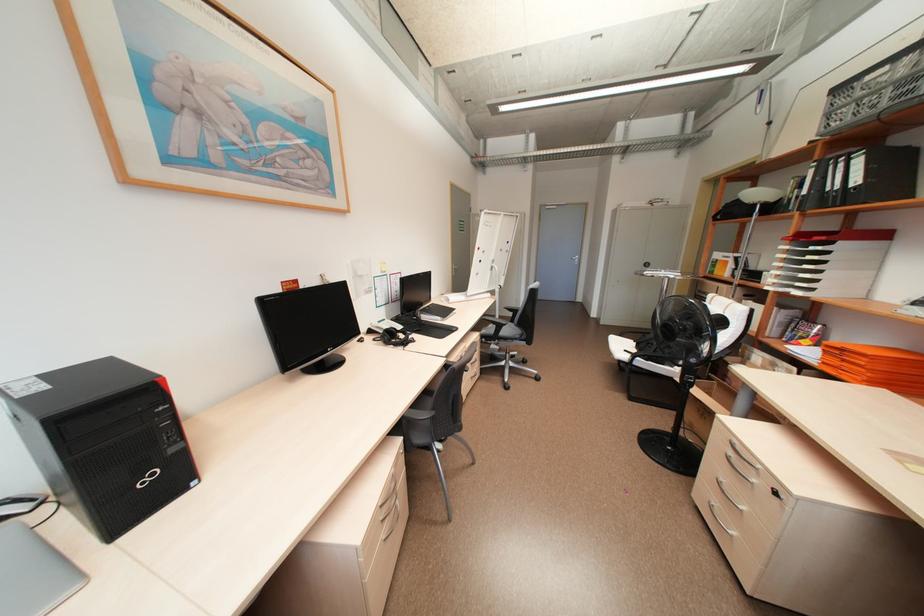
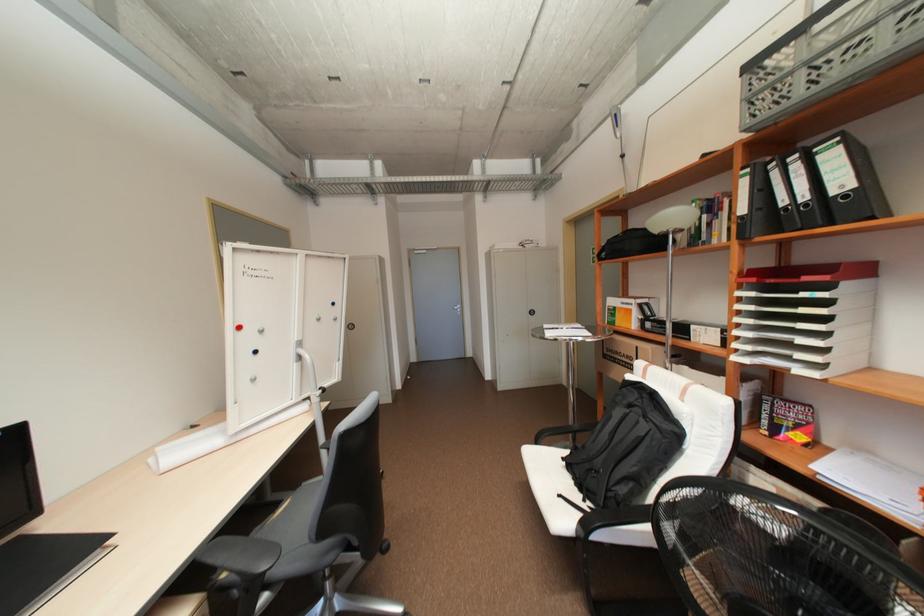
Locate, in the second image, the point that corresponds to (794,346) in the first image.

(820, 467)